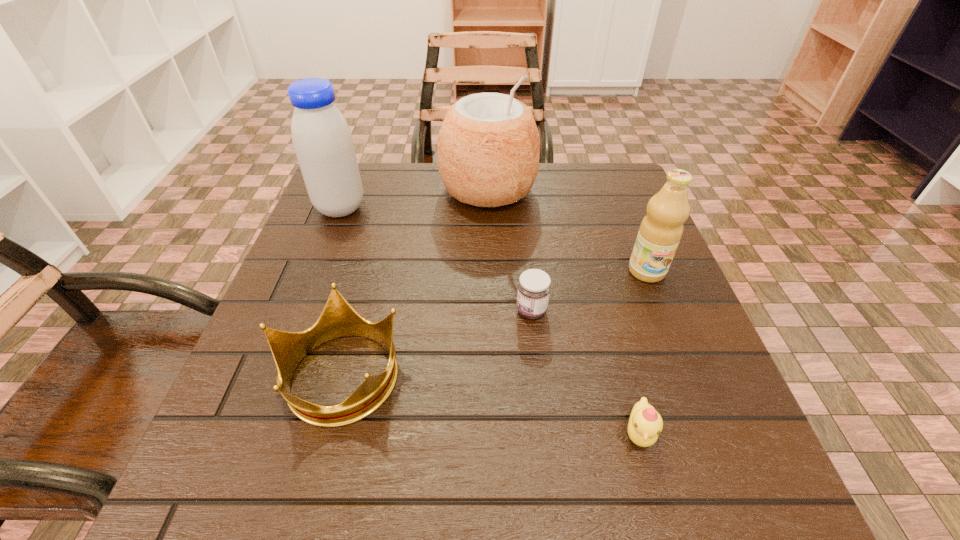
Identify the location of free spot between the soya milk and the coconut. 415,199.

Where is `vacant area between the duckling and the coconut`? This screenshot has width=960, height=540. vacant area between the duckling and the coconut is located at coordinates (564, 311).

This screenshot has width=960, height=540. Identify the location of free space between the soya milk and the third nearest object. (436, 259).

I want to click on free area in between the coconut and the soya milk, so click(415, 199).

You are a GUI agent. You are given a task and a screenshot of the screen. Output one action in this format:
    pyautogui.click(x=<x>, y=<y>)
    Task: Click on the free point between the jam and the fifth object from left to right
    
    Given the screenshot: What is the action you would take?
    pyautogui.click(x=586, y=372)

Where is `empty space between the fourth nearest object and the soya milk`? empty space between the fourth nearest object and the soya milk is located at coordinates (493, 240).

Identify the location of free space between the fourth nearest object and the coconut. (567, 231).

Find the location of a particular element. The height and width of the screenshot is (540, 960). vacant area between the rightmost object and the jam is located at coordinates [589, 291].

This screenshot has width=960, height=540. What are the coordinates of `empty space between the duckling and the third farthest object` in the screenshot? It's located at (643, 352).

You are a GUI agent. You are given a task and a screenshot of the screen. Output one action in this format:
    pyautogui.click(x=<x>, y=<y>)
    Task: Click on the object that is the fifth nearest to the crown
    
    Given the screenshot: What is the action you would take?
    pyautogui.click(x=660, y=232)